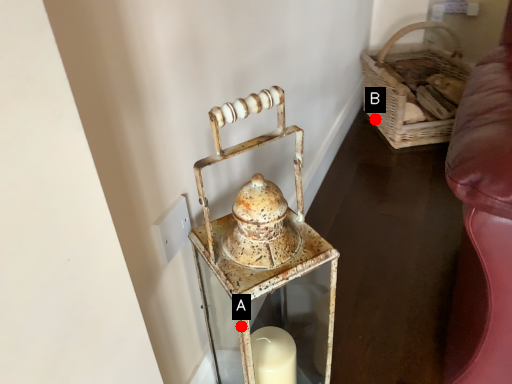
Question: Two points are circled on the image, labeled by A and B beside each circle. Which of the following is the farthest from the observer?

Choices:
 (A) A is further
 (B) B is further

Answer: (B)